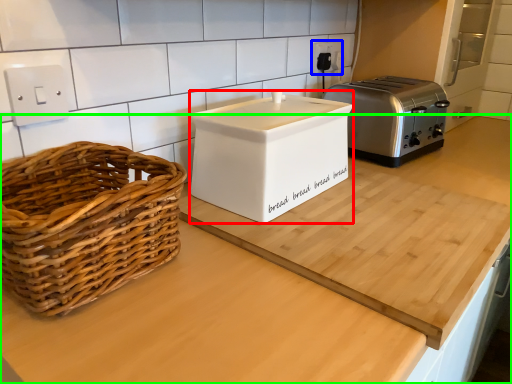
Question: Based on their relative distances, which object is farther from appliance (highlighted by a red box)? Choose from electric outlet (highlighted by a blue box) and countertop (highlighted by a green box).

Choices:
 (A) electric outlet
 (B) countertop

Answer: (A)